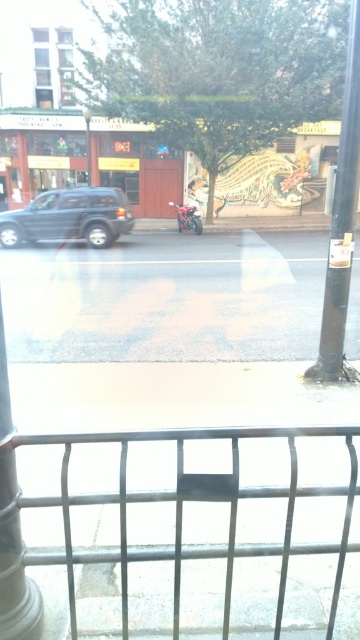
Question: Does black metal pole at right lie in front of dark gray matte suv at left?

Choices:
 (A) yes
 (B) no

Answer: (A)

Question: Which point is farther to the camera?

Choices:
 (A) black metal pole at right
 (B) metallic silver fence at lower center
 (C) dark gray matte suv at left

Answer: (C)

Question: Which object is farther from the camera taking this photo?

Choices:
 (A) white glossy pillar at lower left
 (B) gray asphalt pavement at center

Answer: (B)

Question: Is the position of dark gray matte suv at left more distant than that of shiny red motorcycle at center?

Choices:
 (A) yes
 (B) no

Answer: (B)

Question: Which point is farther from the camera taking this photo?

Choices:
 (A) (32, 582)
 (B) (102, 358)
 (C) (119, 476)
 (D) (87, 131)

Answer: (D)

Question: Observing the image, what is the correct spatial positioning of shiny red motorcycle at center in reference to metallic pole at center?

Choices:
 (A) left
 (B) right

Answer: (B)